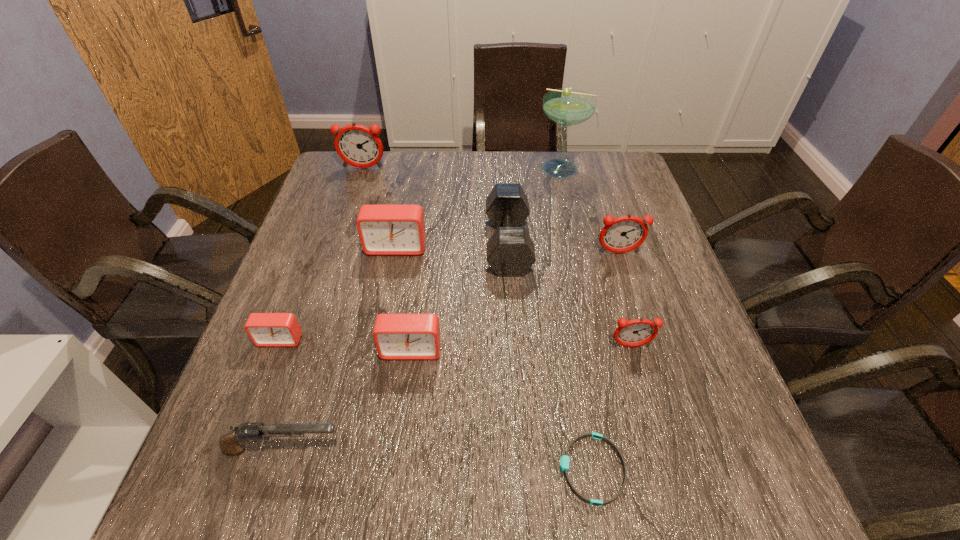
The height and width of the screenshot is (540, 960). Identify the location of alarm clock that stands as the closest to the wristband. (637, 332).

Identify the location of reddish-pink alarm clock that is the third closest to the second biggest red alarm clock. pos(358,146).

Locate an element on the screen. The width and height of the screenshot is (960, 540). reddish-pink alarm clock identified as the third closest to the leftmost red alarm clock is located at coordinates (626, 233).

Where is `the second closest red alarm clock to the leftmost reddish-pink alarm clock`? This screenshot has height=540, width=960. the second closest red alarm clock to the leftmost reddish-pink alarm clock is located at coordinates (264, 329).

Where is `red alarm clock that is the third closest to the tallest object`? The width and height of the screenshot is (960, 540). red alarm clock that is the third closest to the tallest object is located at coordinates (264, 329).